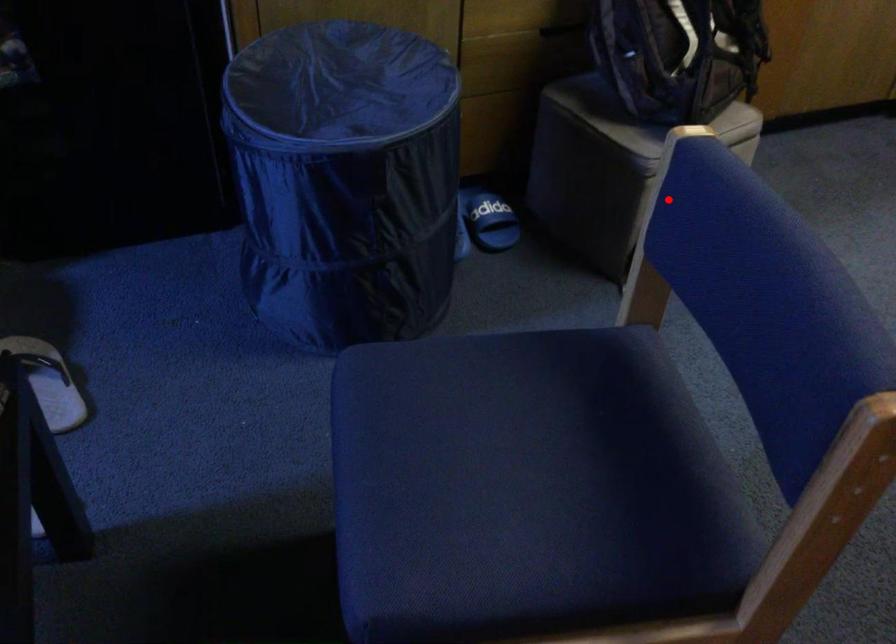
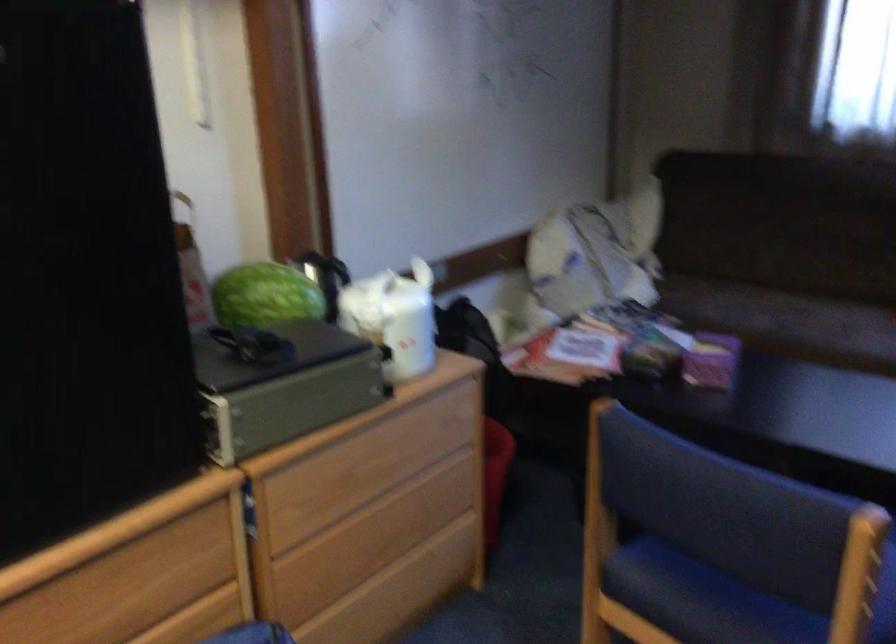
Where in the second image is the point corresponding to the highlighted location from the first image?

(858, 574)